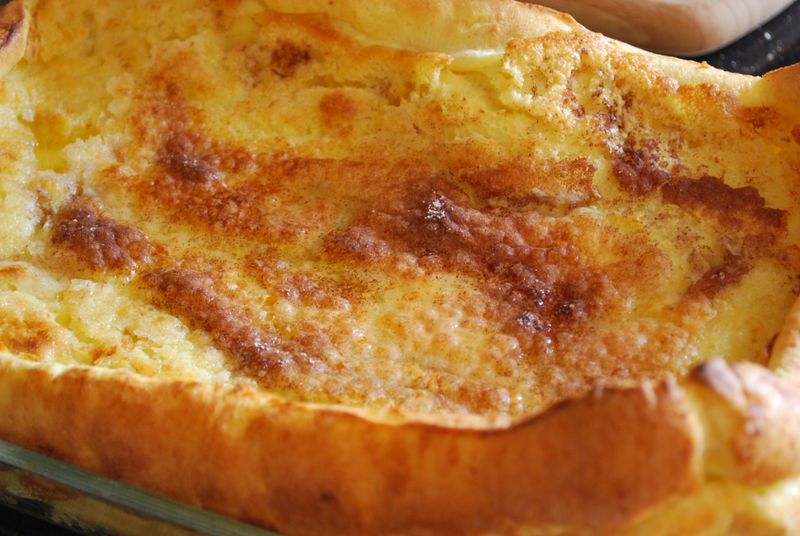
This screenshot has height=536, width=800. Identify the location of dish. (42, 361), (41, 471).